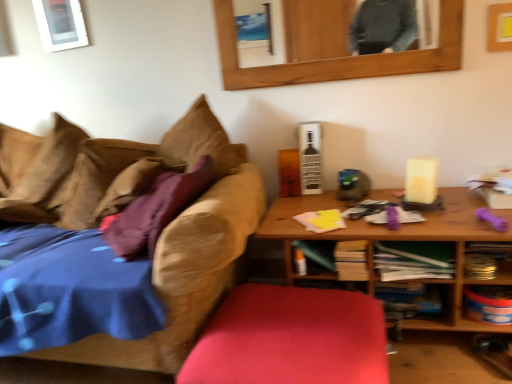
Describe the element at coordinates (291, 338) in the screenshot. I see `smooth red cushion at center` at that location.

Measure the distance between smooth red cushion at center and camera.

smooth red cushion at center is 3.70 feet away from camera.

The image size is (512, 384). What are the coordinates of `green matte book at center, the 1th book positioned from the left` in the screenshot? It's located at (318, 252).

Image resolution: width=512 pixels, height=384 pixels. What are the coordinates of `yellow paper at center, positioned as the 3th book in right-to-left order` in the screenshot? It's located at (321, 220).

The image size is (512, 384). What do you see at coordinates (321, 220) in the screenshot?
I see `yellow paper at center, positioned as the 3th book in right-to-left order` at bounding box center [321, 220].

Describe the element at coordinates (402, 240) in the screenshot. This screenshot has width=512, height=384. I see `wooden table at right` at that location.

Find the location of a particular element. The height and width of the screenshot is (384, 512). metallic gold canisters at lower right, which is the first shelf in top-to-bottom order is located at coordinates (x=487, y=259).

This screenshot has height=384, width=512. Find the location of `smooth red cushion at center`. smooth red cushion at center is located at coordinates (291, 338).

Could you measure the distance between metallic silver canister at lower right, the 1th shelf in the bottom-to-top sequence, and wooden table at right?

metallic silver canister at lower right, the 1th shelf in the bottom-to-top sequence, and wooden table at right are 12.84 inches apart from each other.

From the image's perspective, is metallic silver canister at lower right, the 1th shelf in the bottom-to-top sequence, on top of wooden table at right?

No, from the image's perspective, metallic silver canister at lower right, the 1th shelf in the bottom-to-top sequence, is not above wooden table at right.

Which is closer to the camera, (x=497, y=296) or (x=454, y=202)?

Clearly, point (x=497, y=296) is closer to the camera than point (x=454, y=202).

Does metallic silver canister at lower right, the 1th shelf in the bottom-to-top sequence, come in front of wooden table at right?

No, metallic silver canister at lower right, the 1th shelf in the bottom-to-top sequence, is behind wooden table at right.

Which of these two, metallic silver canister at lower right, the 2th shelf viewed from the top, or yellow paper at center, acting as the second book starting from the left, stands shorter?

Standing shorter between the two is yellow paper at center, acting as the second book starting from the left.

Between metallic silver canister at lower right, the 2th shelf viewed from the top, and yellow paper at center, positioned as the 3th book in right-to-left order, which one appears on the left side from the viewer's perspective?

yellow paper at center, positioned as the 3th book in right-to-left order.

Is metallic silver canister at lower right, the 2th shelf viewed from the top, facing away from yellow paper at center, acting as the second book starting from the left?

No, metallic silver canister at lower right, the 2th shelf viewed from the top, is not facing the opposite direction of yellow paper at center, acting as the second book starting from the left.

Locate an element on the screen. mirror lying on the left of matte yellow picture frame at upper right, positioned as the second picture frame in back-to-front order is located at coordinates (331, 47).

Is wooden mirror at upper center next to matte yellow picture frame at upper right, which is counted as the 1th picture frame, starting from the front?

wooden mirror at upper center is not next to matte yellow picture frame at upper right, which is counted as the 1th picture frame, starting from the front, and they're not touching.

Which is more distant, (267, 86) or (497, 10)?

The point (267, 86) is more distant.

From the image's perspective, is wooden mirror at upper center under matte yellow picture frame at upper right, the first picture frame in the bottom-to-top sequence?

Incorrect, from the image's perspective, wooden mirror at upper center is higher than matte yellow picture frame at upper right, the first picture frame in the bottom-to-top sequence.

Relative to wooden mirror at upper center, is white glossy picture frame at upper left, marked as the 1th picture frame in a left-to-right arrangement, in front or behind?

Visually, white glossy picture frame at upper left, marked as the 1th picture frame in a left-to-right arrangement, is located behind wooden mirror at upper center.

From a real-world perspective, which object rests below the other?

wooden mirror at upper center, from a real-world perspective.

Does point (71, 11) lie behind point (343, 51)?

Yes, point (71, 11) is farther from viewer.

Is white glossy picture frame at upper left, which is the first picture frame in back-to-front order, positioned beyond the bounds of wooden mirror at upper center?

Absolutely, white glossy picture frame at upper left, which is the first picture frame in back-to-front order, is external to wooden mirror at upper center.

Is brown suede pillow at left, the second pillow positioned from the right, not within metallic gold canisters at lower right, the second shelf positioned from the bottom?

Yes.

From the image's perspective, is brown suede pillow at left, which ranks as the second pillow in left-to-right order, over metallic gold canisters at lower right, the second shelf positioned from the bottom?

Yes.

Locate an element on the screen. Image resolution: width=512 pixels, height=384 pixels. the 1st shelf below the brown suede pillow at left, the second pillow positioned from the right (from a real-world perspective) is located at coordinates (487, 259).

Does brown suede pillow at left, the second pillow positioned from the right, have a greater height compared to purple velvet pillow at center, which is the first pillow from right to left?

Incorrect, the height of brown suede pillow at left, the second pillow positioned from the right, is not larger of that of purple velvet pillow at center, which is the first pillow from right to left.

From the image's perspective, between brown suede pillow at left, the second pillow positioned from the right, and purple velvet pillow at center, the 3th pillow in the left-to-right sequence, which one is located above?

brown suede pillow at left, the second pillow positioned from the right, is shown above in the image.

Who is more distant, brown suede pillow at left, the second pillow positioned from the right, or purple velvet pillow at center, which is the first pillow from right to left?

brown suede pillow at left, the second pillow positioned from the right, is more distant.

Locate an element on the screen. Image resolution: width=512 pixels, height=384 pixels. pillow in front of the brown suede pillow at left, which ranks as the second pillow in left-to-right order is located at coordinates (155, 210).

Where is `shelf that is the 1st object located below the purple velvet pillow at center, the 3th pillow in the left-to-right sequence (from the image's perspective)`? This screenshot has width=512, height=384. shelf that is the 1st object located below the purple velvet pillow at center, the 3th pillow in the left-to-right sequence (from the image's perspective) is located at coordinates (487, 259).

Who is taller, purple velvet pillow at center, the 3th pillow in the left-to-right sequence, or metallic gold canisters at lower right, the second shelf positioned from the bottom?

With more height is purple velvet pillow at center, the 3th pillow in the left-to-right sequence.

Can metallic gold canisters at lower right, the second shelf positioned from the bottom, be found inside purple velvet pillow at center, which is the first pillow from right to left?

That's incorrect, metallic gold canisters at lower right, the second shelf positioned from the bottom, is not inside purple velvet pillow at center, which is the first pillow from right to left.

Looking at this image, is purple velvet pillow at center, which is the first pillow from right to left, far from metallic gold canisters at lower right, the second shelf positioned from the bottom?

Yes, purple velvet pillow at center, which is the first pillow from right to left, is far from metallic gold canisters at lower right, the second shelf positioned from the bottom.

You are a GUI agent. You are given a task and a screenshot of the screen. Output one action in this format:
    pyautogui.click(x=<x>, y=<y>)
    Task: Click on the shelf below the wooden table at right (from the image's perspective)
    The image size is (512, 384).
    Given the screenshot: What is the action you would take?
    pyautogui.click(x=488, y=304)

Locate an element on the screen. The width and height of the screenshot is (512, 384). shelf that is the 1st one when counting rightward from the yellow paper at center, positioned as the 3th book in right-to-left order is located at coordinates (488, 304).

Consider the image. Looking at the image, which one is located closer to wooden book at center, marked as the second book in a right-to-left arrangement, green paper at center, the 4th book from the left, or brown fabric pillow at left, which is the third pillow in right-to-left order?

Among the two, green paper at center, the 4th book from the left, is located nearer to wooden book at center, marked as the second book in a right-to-left arrangement.

Estimate the real-world distances between objects in this image. Which object is closer to textured brown couch at left, green matte book at center, which is the 4th book in right-to-left order, or brown fabric pillow at left, which is counted as the 1th pillow, starting from the left?

green matte book at center, which is the 4th book in right-to-left order, is closer to textured brown couch at left.

Looking at the image, which one is located closer to metallic silver canister at lower right, the 1th shelf in the bottom-to-top sequence, brown fabric pillow at left, which is counted as the 1th pillow, starting from the left, or green paper at center, the 4th book from the left?

The object closer to metallic silver canister at lower right, the 1th shelf in the bottom-to-top sequence, is green paper at center, the 4th book from the left.

From the image, which object appears to be nearer to matte yellow picture frame at upper right, which is counted as the 1th picture frame, starting from the front, white glossy picture frame at upper left, which appears as the 2th picture frame when viewed from the right, or green matte book at center, the 1th book positioned from the left?

Based on the image, green matte book at center, the 1th book positioned from the left, appears to be nearer to matte yellow picture frame at upper right, which is counted as the 1th picture frame, starting from the front.

Based on their spatial positions, is brown suede pillow at left, which ranks as the second pillow in left-to-right order, or green matte book at center, which is the 4th book in right-to-left order, closer to wooden table at right?

green matte book at center, which is the 4th book in right-to-left order, is positioned closer to the anchor wooden table at right.

Estimate the real-world distances between objects in this image. Which object is further from smooth red cushion at center, textured brown couch at left or yellow paper at center, positioned as the 3th book in right-to-left order?

yellow paper at center, positioned as the 3th book in right-to-left order, lies further to smooth red cushion at center than the other object.

Looking at the image, which one is located closer to metallic gold canisters at lower right, the second shelf positioned from the bottom, white glossy picture frame at upper left, positioned as the 1th picture frame in top-to-bottom order, or textured brown couch at left?

textured brown couch at left.

Based on their spatial positions, is green paper at center, which is counted as the 1th book, starting from the right, or brown suede pillow at left, which ranks as the second pillow in left-to-right order, closer to metallic gold canisters at lower right, the second shelf positioned from the bottom?

green paper at center, which is counted as the 1th book, starting from the right, is positioned closer to the anchor metallic gold canisters at lower right, the second shelf positioned from the bottom.

Image resolution: width=512 pixels, height=384 pixels. Identify the location of swivel chair located between textured brown couch at left and wooden book at center, the 3th book viewed from the left, in the left-right direction. (291, 338).

Find the location of a particular element. This screenshot has width=512, height=384. shelf that lies between matte yellow picture frame at upper right, which is the 2th picture frame from left to right, and wooden table at right from top to bottom is located at coordinates [x=487, y=259].

The image size is (512, 384). I want to click on table between smooth red cushion at center and metallic silver canister at lower right, the 1th shelf in the bottom-to-top sequence, from left to right, so pos(402,240).

The image size is (512, 384). Identify the location of shelf between purple velvet pillow at center, the 3th pillow in the left-to-right sequence, and metallic gold canisters at lower right, the second shelf positioned from the bottom, from left to right. (488, 304).